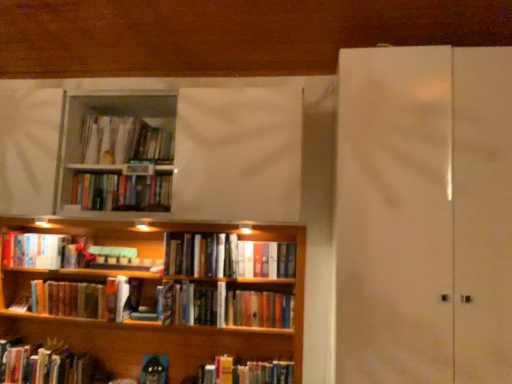
You are a GUI agent. You are given a task and a screenshot of the screen. Output one action in this format:
    pyautogui.click(x=<x>, y=<y>)
    Task: Click on the hardcover book at lower left, which is the second book in bottom-to-top order
    The width and height of the screenshot is (512, 384).
    Given the screenshot: What is the action you would take?
    pyautogui.click(x=68, y=299)

You are a GUI agent. You are given a task and a screenshot of the screen. Output one action in this format:
    pyautogui.click(x=<x>, y=<y>)
    Task: Click on the hardcover books at center, the fourth book when ordered from bottom to top
    The height and width of the screenshot is (384, 512).
    Given the screenshot: What is the action you would take?
    pyautogui.click(x=225, y=257)

Find the location of a particular element. This screenshot has height=384, width=512. hardcover books at upper center, the seventh book from the bottom is located at coordinates (124, 141).

The width and height of the screenshot is (512, 384). Identify the location of hardcover books at center, positioned as the 3th book in bottom-to-top order. (266, 259).

What are the coordinates of `hardcover book at lower left, which is the second book in bottom-to-top order` in the screenshot? It's located at (68, 299).

Does hardcover books at lower left, which ranks as the seventh book in top-to-bottom order, touch hardcover book at left, positioned as the fifth book in bottom-to-top order?

No, hardcover books at lower left, which ranks as the seventh book in top-to-bottom order, is not next to hardcover book at left, positioned as the fifth book in bottom-to-top order.

Is hardcover books at lower left, acting as the 1th book starting from the bottom, at the right side of hardcover book at left, positioned as the fifth book in bottom-to-top order?

Yes, hardcover books at lower left, acting as the 1th book starting from the bottom, is to the right of hardcover book at left, positioned as the fifth book in bottom-to-top order.

From a real-world perspective, is hardcover books at lower left, acting as the 1th book starting from the bottom, on top of hardcover book at left, positioned as the third book in top-to-bottom order?

No, from a real-world perspective, hardcover books at lower left, acting as the 1th book starting from the bottom, is not over hardcover book at left, positioned as the third book in top-to-bottom order

Does hardcover books at lower left, which ranks as the seventh book in top-to-bottom order, have a smaller size compared to hardcover book at left, positioned as the third book in top-to-bottom order?

Incorrect, hardcover books at lower left, which ranks as the seventh book in top-to-bottom order, is not smaller in size than hardcover book at left, positioned as the third book in top-to-bottom order.

Is hardcover books at center, arranged as the second book when viewed from the top, not close to hardcover book at left, positioned as the fifth book in bottom-to-top order?

hardcover books at center, arranged as the second book when viewed from the top, is actually quite close to hardcover book at left, positioned as the fifth book in bottom-to-top order.

Considering the relative sizes of hardcover books at center, arranged as the second book when viewed from the top, and hardcover book at left, positioned as the fifth book in bottom-to-top order, in the image provided, is hardcover books at center, arranged as the second book when viewed from the top, bigger than hardcover book at left, positioned as the fifth book in bottom-to-top order,?

No, hardcover books at center, arranged as the second book when viewed from the top, is not bigger than hardcover book at left, positioned as the fifth book in bottom-to-top order.

From the image's perspective, which book is the 1st one below the hardcover books at center, arranged as the second book when viewed from the top? Please provide its 2D coordinates.

[(42, 251)]

Considering the sizes of objects hardcover book at left, positioned as the fifth book in bottom-to-top order, and hardcover books at center, positioned as the sixth book in bottom-to-top order, in the image provided, who is taller, hardcover book at left, positioned as the fifth book in bottom-to-top order, or hardcover books at center, positioned as the sixth book in bottom-to-top order,?

With more height is hardcover book at left, positioned as the fifth book in bottom-to-top order.

Which object is wider, hardcover book at left, positioned as the third book in top-to-bottom order, or hardcover books at center, positioned as the sixth book in bottom-to-top order?

With larger width is hardcover book at left, positioned as the third book in top-to-bottom order.

Is hardcover book at left, positioned as the fifth book in bottom-to-top order, in front of or behind hardcover books at center, positioned as the sixth book in bottom-to-top order, in the image?

In the image, hardcover book at left, positioned as the fifth book in bottom-to-top order, appears behind hardcover books at center, positioned as the sixth book in bottom-to-top order.

In the scene shown: From the image's perspective, is hardcover book at left, positioned as the third book in top-to-bottom order, on hardcover books at center, arranged as the second book when viewed from the top?

No, from the image's perspective, hardcover book at left, positioned as the third book in top-to-bottom order, is not above hardcover books at center, arranged as the second book when viewed from the top.

From the image's perspective, is wooden bookcase at lower left on hardcover books at center, which is the fourth book from top to bottom?

No.

Which is correct: wooden bookcase at lower left is inside hardcover books at center, the fourth book when ordered from bottom to top, or outside of it?

wooden bookcase at lower left is outside hardcover books at center, the fourth book when ordered from bottom to top.

Is wooden bookcase at lower left further to camera compared to hardcover books at center, which is the fourth book from top to bottom?

No, it is in front of hardcover books at center, which is the fourth book from top to bottom.

Locate an element on the screen. This screenshot has width=512, height=384. the 1st book counting from the right of the wooden bookcase at lower left is located at coordinates (225, 257).

From a real-world perspective, does hardcover book at lower left, which is the second book in bottom-to-top order, sit lower than hardcover book at left, positioned as the third book in top-to-bottom order?

Correct, in the physical world, hardcover book at lower left, which is the second book in bottom-to-top order, is lower than hardcover book at left, positioned as the third book in top-to-bottom order.

From the image's perspective, between hardcover book at lower left, which ranks as the 6th book in top-to-bottom order, and hardcover book at left, positioned as the third book in top-to-bottom order, which one is located above?

From the image's view, hardcover book at left, positioned as the third book in top-to-bottom order, is above.

Locate an element on the screen. The height and width of the screenshot is (384, 512). book that is behind the hardcover book at lower left, which ranks as the 6th book in top-to-bottom order is located at coordinates (42, 251).

Can we say hardcover book at lower left, which ranks as the 6th book in top-to-bottom order, lies outside hardcover book at left, positioned as the third book in top-to-bottom order?

Yes.

In the scene shown: Considering the relative sizes of hardcover books at upper center, the seventh book from the bottom, and hardcover book at left, positioned as the third book in top-to-bottom order, in the image provided, is hardcover books at upper center, the seventh book from the bottom, taller than hardcover book at left, positioned as the third book in top-to-bottom order,?

Yes, hardcover books at upper center, the seventh book from the bottom, is taller than hardcover book at left, positioned as the third book in top-to-bottom order.

How distant is hardcover books at upper center, which is the first book in top-to-bottom order, from hardcover book at left, positioned as the third book in top-to-bottom order?

hardcover books at upper center, which is the first book in top-to-bottom order, is 28.89 inches away from hardcover book at left, positioned as the third book in top-to-bottom order.

Is the surface of hardcover books at upper center, the seventh book from the bottom, in direct contact with hardcover book at left, positioned as the fifth book in bottom-to-top order?

They are not placed beside each other.

Would you say hardcover book at left, positioned as the third book in top-to-bottom order, is part of hardcover books at upper center, which is the first book in top-to-bottom order,'s contents?

No.

Can hardcover books at center, the 5th book when ordered from top to bottom, be found inside hardcover book at left, positioned as the third book in top-to-bottom order?

No, hardcover books at center, the 5th book when ordered from top to bottom, is located outside of hardcover book at left, positioned as the third book in top-to-bottom order.

Visually, is hardcover book at left, positioned as the third book in top-to-bottom order, positioned to the left or to the right of hardcover books at center, the 5th book when ordered from top to bottom?

In the image, hardcover book at left, positioned as the third book in top-to-bottom order, appears on the left side of hardcover books at center, the 5th book when ordered from top to bottom.

Is point (83, 255) farther from camera compared to point (255, 274)?

Yes, point (83, 255) is behind point (255, 274).

Is hardcover book at left, positioned as the third book in top-to-bottom order, not close to hardcover books at center, positioned as the 3th book in bottom-to-top order?

Indeed, hardcover book at left, positioned as the third book in top-to-bottom order, is not near hardcover books at center, positioned as the 3th book in bottom-to-top order.

From the image's perspective, count 4th books downward from the hardcover book at left, positioned as the fifth book in bottom-to-top order, and point to it. Please provide its 2D coordinates.

[(42, 364)]

There is a hardcover book at left, positioned as the fifth book in bottom-to-top order. Where is `the 1st book above it (from the image's perspective)`? This screenshot has height=384, width=512. the 1st book above it (from the image's perspective) is located at coordinates (121, 192).

Considering their positions, is white glossy screen door at right positioned further to hardcover books at upper center, the seventh book from the bottom, than hardcover book at lower left, which is the second book in bottom-to-top order?

white glossy screen door at right.

From the image, which object appears to be nearer to hardcover books at upper center, which is the first book in top-to-bottom order, hardcover books at lower left, which ranks as the seventh book in top-to-bottom order, or hardcover books at center, the fourth book when ordered from bottom to top?

Among the two, hardcover books at center, the fourth book when ordered from bottom to top, is located nearer to hardcover books at upper center, which is the first book in top-to-bottom order.

When comparing their distances from white glossy screen door at right, does hardcover books at center, which is the fourth book from top to bottom, or hardcover book at left, positioned as the fifth book in bottom-to-top order, seem closer?

The object closer to white glossy screen door at right is hardcover books at center, which is the fourth book from top to bottom.

From the image, which object appears to be nearer to hardcover books at center, which is the fourth book from top to bottom, hardcover books at center, positioned as the sixth book in bottom-to-top order, or white glossy screen door at right?

hardcover books at center, positioned as the sixth book in bottom-to-top order, is positioned closer to the anchor hardcover books at center, which is the fourth book from top to bottom.

Which object lies nearer to the anchor point white glossy screen door at right, hardcover books at center, positioned as the 3th book in bottom-to-top order, or hardcover books at lower left, which ranks as the seventh book in top-to-bottom order?

hardcover books at center, positioned as the 3th book in bottom-to-top order, is positioned closer to the anchor white glossy screen door at right.

When comparing their distances from hardcover book at lower left, which is the second book in bottom-to-top order, does white glossy screen door at right or hardcover books at center, arranged as the second book when viewed from the top, seem further?

Among the two, white glossy screen door at right is located further to hardcover book at lower left, which is the second book in bottom-to-top order.

Estimate the real-world distances between objects in this image. Which object is closer to hardcover books at upper center, the seventh book from the bottom, hardcover books at center, positioned as the sixth book in bottom-to-top order, or wooden bookcase at lower left?

Among the two, hardcover books at center, positioned as the sixth book in bottom-to-top order, is located nearer to hardcover books at upper center, the seventh book from the bottom.

Looking at this image, looking at the image, which one is located closer to hardcover book at left, positioned as the third book in top-to-bottom order, white glossy screen door at right or hardcover books at lower left, which ranks as the seventh book in top-to-bottom order?

Among the two, hardcover books at lower left, which ranks as the seventh book in top-to-bottom order, is located nearer to hardcover book at left, positioned as the third book in top-to-bottom order.

Where is `book between wooden bookcase at lower left and hardcover books at center, positioned as the 3th book in bottom-to-top order, in the horizontal direction`? book between wooden bookcase at lower left and hardcover books at center, positioned as the 3th book in bottom-to-top order, in the horizontal direction is located at coordinates (225, 257).

Identify the location of book situated between hardcover books at center, which is the fourth book from top to bottom, and white glossy screen door at right from left to right. [x=266, y=259].

Where is `bookcase between hardcover books at upper center, which is the first book in top-to-bottom order, and hardcover books at lower left, which ranks as the seventh book in top-to-bottom order, in the up-down direction`? The width and height of the screenshot is (512, 384). bookcase between hardcover books at upper center, which is the first book in top-to-bottom order, and hardcover books at lower left, which ranks as the seventh book in top-to-bottom order, in the up-down direction is located at coordinates (154, 304).

Locate an element on the screen. This screenshot has width=512, height=384. bookcase between hardcover book at left, positioned as the fifth book in bottom-to-top order, and hardcover books at center, which is the fourth book from top to bottom is located at coordinates (154, 304).